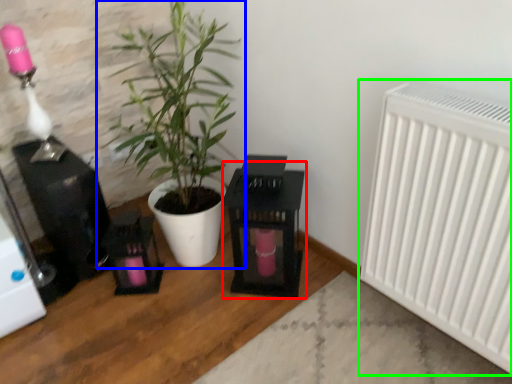
Question: Considering the real-world distances, which object is farthest from table (highlighted by a red box)? houseplant (highlighted by a blue box) or radiator (highlighted by a green box)?

Choices:
 (A) houseplant
 (B) radiator

Answer: (B)